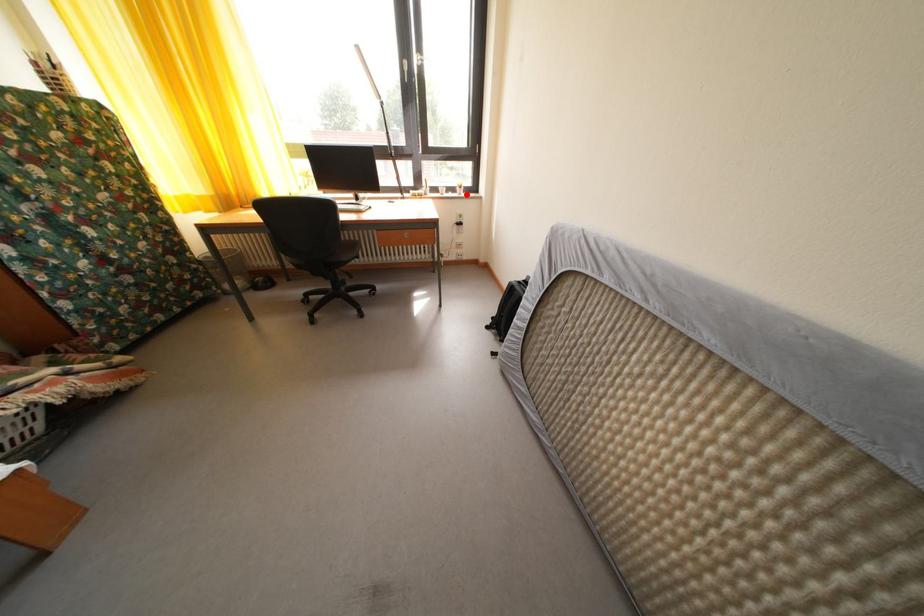
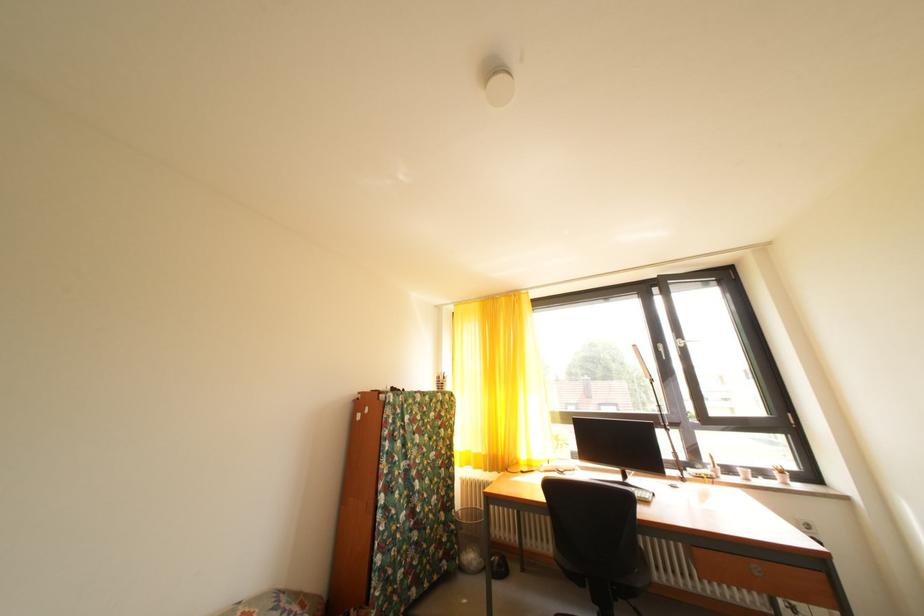
In the second image, find the point that corresponds to the highlighted location in the first image.

(784, 479)